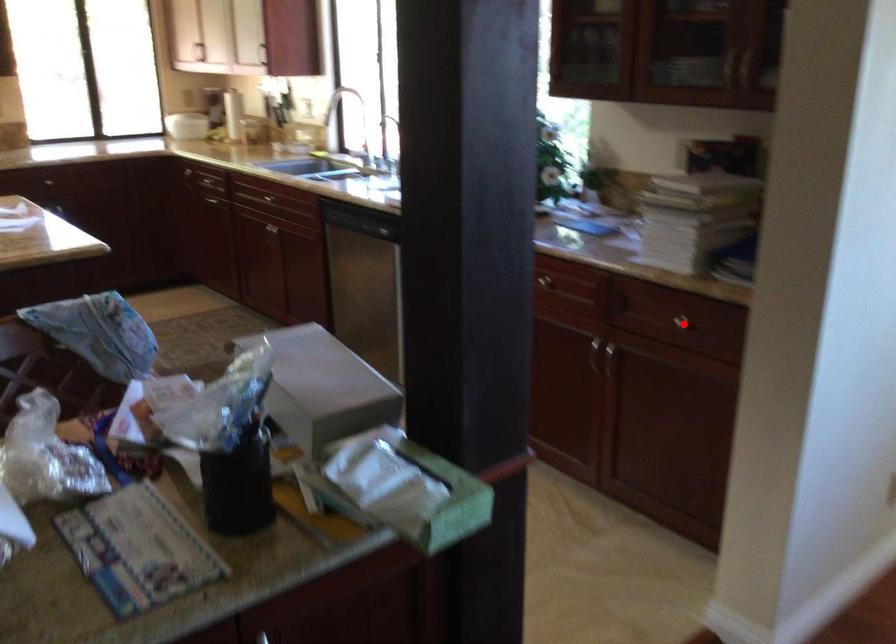
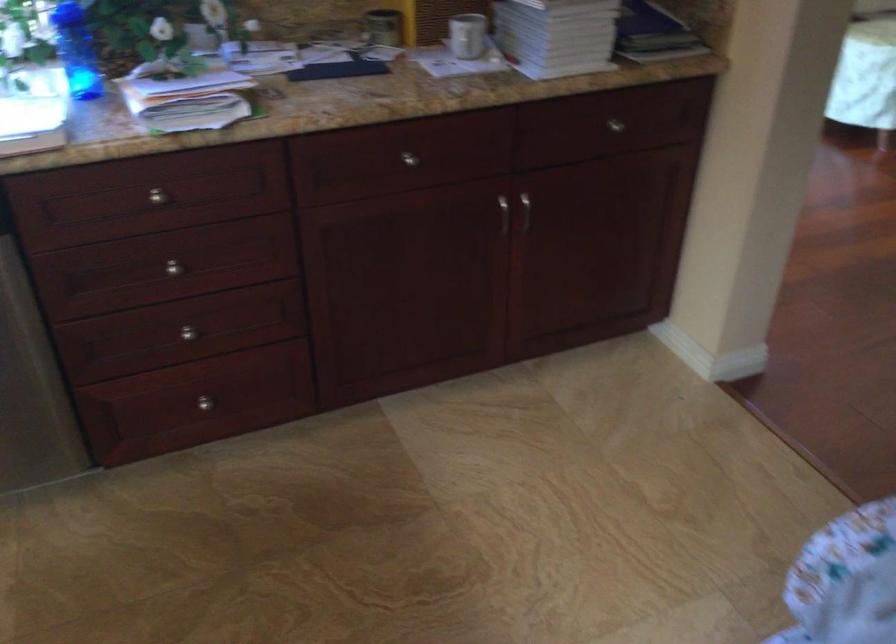
Where in the second image is the point corresponding to the highlighted location from the first image?

(615, 125)